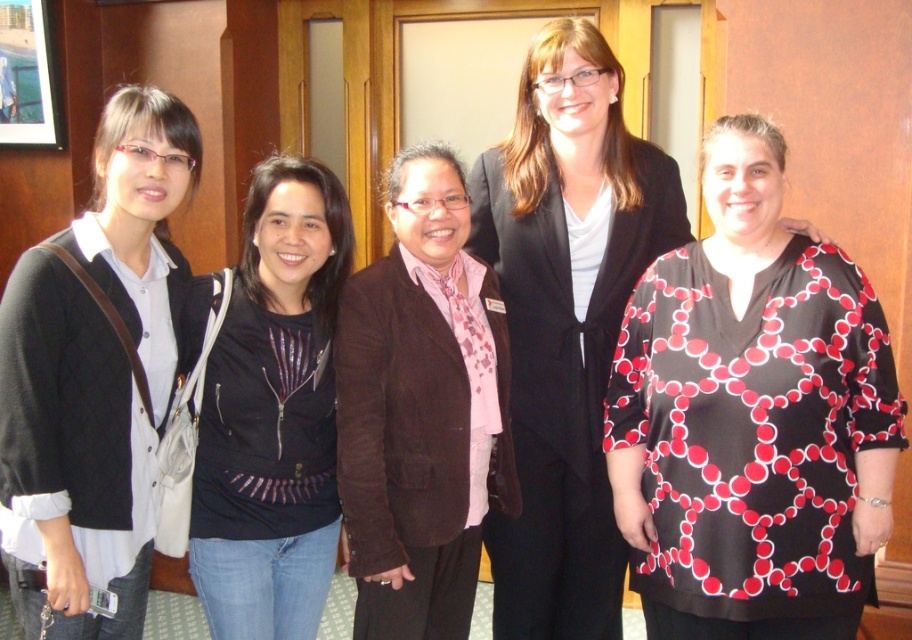
Question: Where is black printed blouse at center located in relation to black sequined jacket at center in the image?

Choices:
 (A) above
 (B) below

Answer: (A)

Question: Which is nearer to the black sequined jacket at center?

Choices:
 (A) black matte cardigan at left
 (B) black printed blouse at center

Answer: (A)

Question: From the image, what is the correct spatial relationship of black printed blouse at center in relation to black sequined jacket at center?

Choices:
 (A) right
 (B) left

Answer: (A)

Question: Does black printed blouse at center have a larger size compared to black sequined jacket at center?

Choices:
 (A) no
 (B) yes

Answer: (B)

Question: Among these objects, which one is farthest from the camera?

Choices:
 (A) black printed blouse at center
 (B) black sequined jacket at center
 (C) black textured blouse at center
 (D) black matte cardigan at left

Answer: (C)

Question: Which point is farther from the camera taking this photo?

Choices:
 (A) (315, 634)
 (B) (570, 184)

Answer: (A)